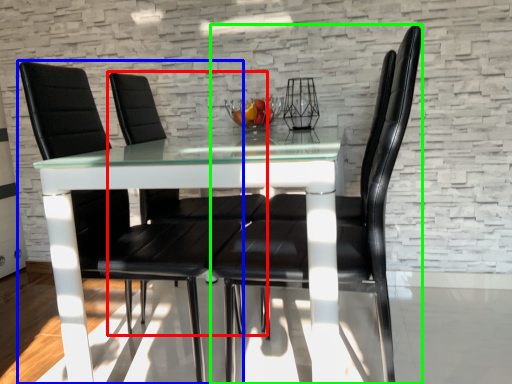
Question: Based on their relative distances, which object is nearer to chair (highlighted by a red box)? Choose from chair (highlighted by a blue box) and chair (highlighted by a green box).

Choices:
 (A) chair
 (B) chair

Answer: (A)